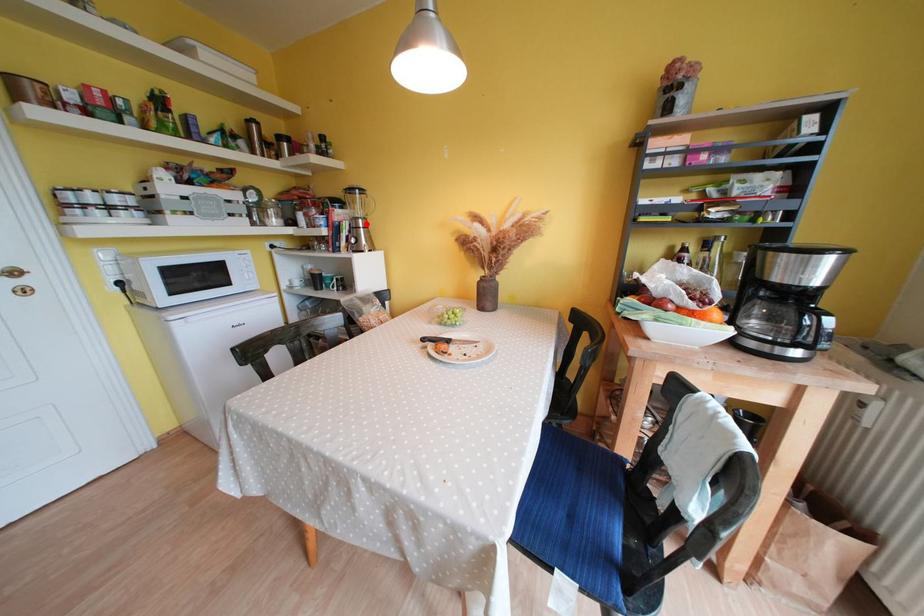
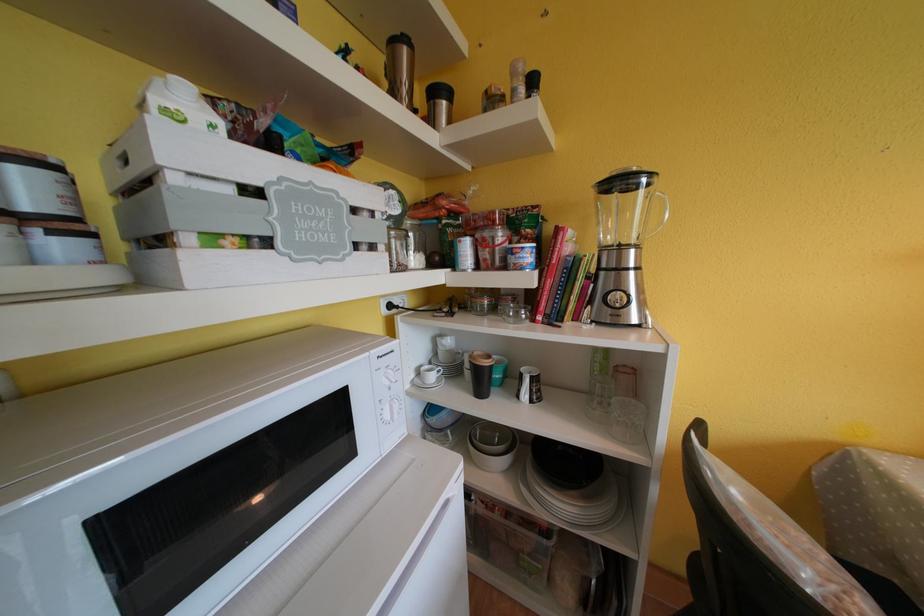
In the second image, find the point that corresponds to the highlighted location in the first image.

(638, 254)